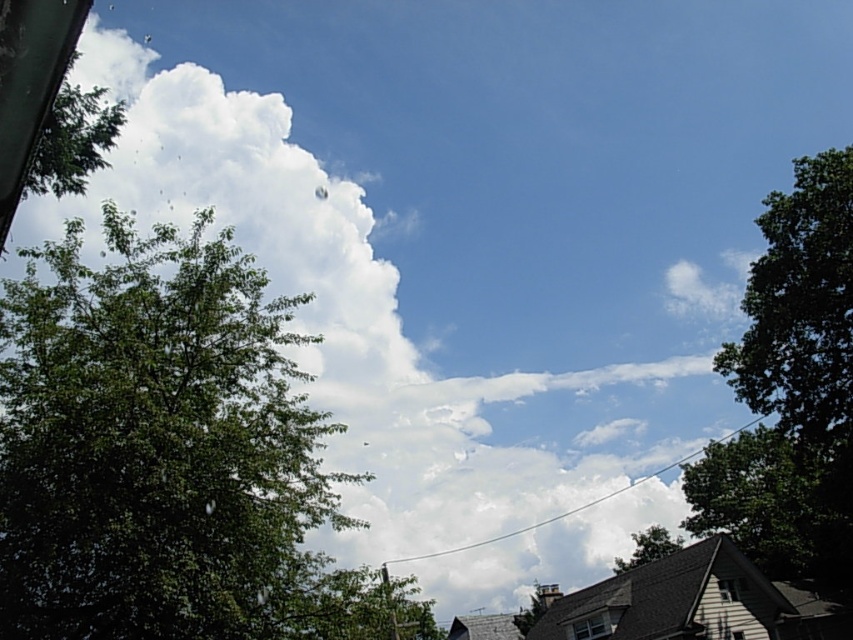
Question: Considering the relative positions of green leafy tree at left and green leafy tree at center in the image provided, where is green leafy tree at left located with respect to green leafy tree at center?

Choices:
 (A) above
 (B) below

Answer: (A)

Question: Does green leafy tree at left come in front of green leafy tree at right?

Choices:
 (A) yes
 (B) no

Answer: (A)

Question: Which point is closer to the camera?

Choices:
 (A) (184, 497)
 (B) (654, 547)
 (C) (839, 321)

Answer: (A)

Question: Is green leafy tree at left positioned in front of green leafy tree at center?

Choices:
 (A) no
 (B) yes

Answer: (B)

Question: Which point is farther to the camera?

Choices:
 (A) (804, 440)
 (B) (665, 531)
 (C) (200, 282)

Answer: (B)

Question: Among these objects, which one is nearest to the camera?

Choices:
 (A) green leafy tree at left
 (B) green leafy tree at center

Answer: (A)